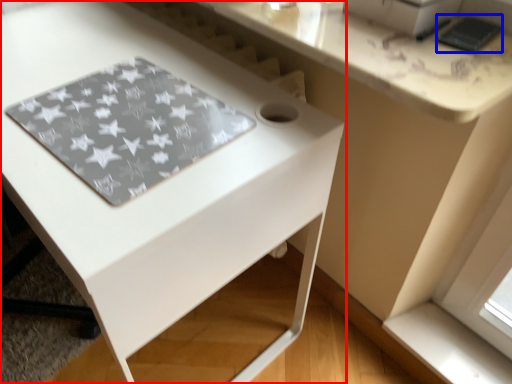
Question: Which of the following is the closest to the observer, table (highlighted by a red box) or pad (highlighted by a blue box)?

Choices:
 (A) table
 (B) pad

Answer: (A)